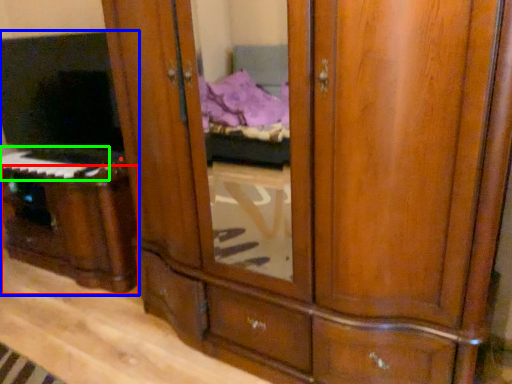
Question: Estimate the real-world distances between objects in this image. Which object is closer to vanity (highlighted by a red box), entertainment center (highlighted by a blue box) or musical keyboard (highlighted by a green box)?

Choices:
 (A) entertainment center
 (B) musical keyboard

Answer: (A)